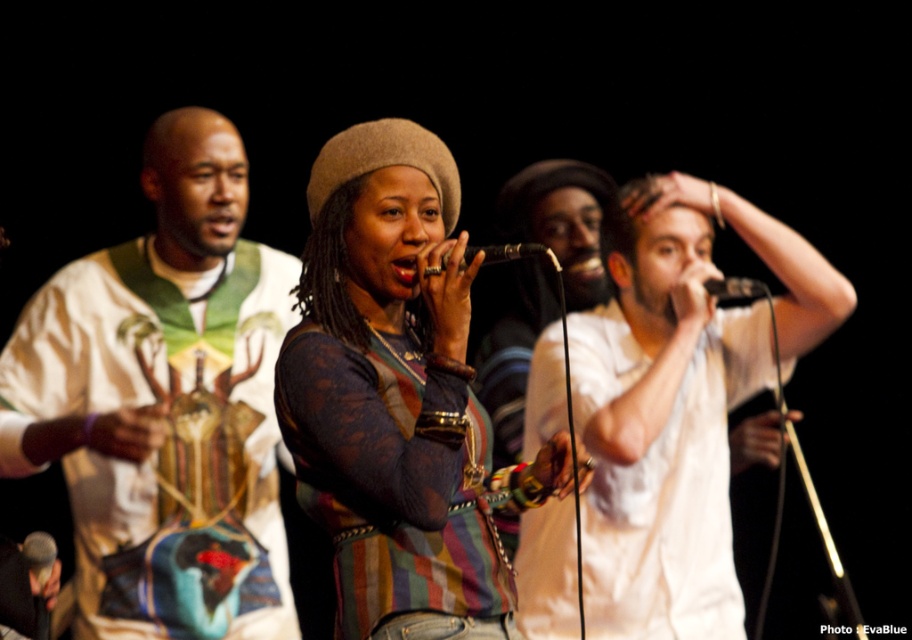
Is point (348, 314) farther from camera compared to point (47, 561)?

No, it is in front of (47, 561).

Which is more to the right, multicolored lace top at center or metallic silver microphone at lower left?

Positioned to the right is multicolored lace top at center.

Which is behind, point (345, 314) or point (47, 548)?

The point (47, 548) is behind.

You are a GUI agent. You are given a task and a screenshot of the screen. Output one action in this format:
    pyautogui.click(x=<x>, y=<y>)
    Task: Click on the multicolored lace top at center
    
    Given the screenshot: What is the action you would take?
    pyautogui.click(x=399, y=397)

Can you confirm if white satin shirt at left is wider than black matte microphone at upper center?

Correct, the width of white satin shirt at left exceeds that of black matte microphone at upper center.

Is white satin shirt at left closer to camera compared to black matte microphone at upper center?

That is False.

Between point (195, 529) and point (717, 285), which one is positioned behind?

Point (195, 529)

Where is `white satin shirt at left`? The image size is (912, 640). white satin shirt at left is located at coordinates (164, 404).

Looking at this image, does white satin shirt at left have a greater width compared to white cotton shirt at center?

Incorrect, white satin shirt at left's width does not surpass white cotton shirt at center's.

The height and width of the screenshot is (640, 912). Identify the location of white satin shirt at left. (164, 404).